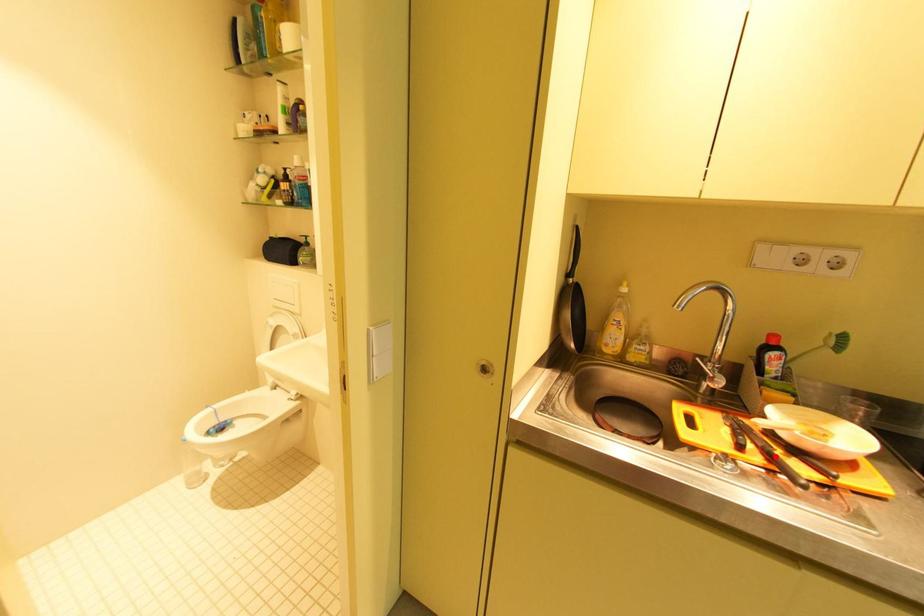
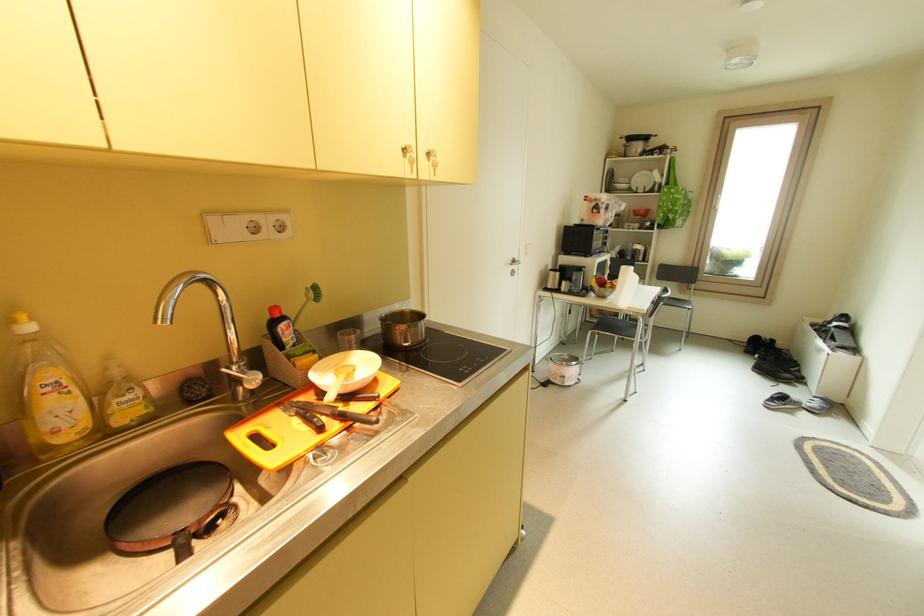
Question: I am providing you with two images of the same scene from different viewpoints. A red point is marked on the first image. At the location where the point appears in image 1, is it still visible in image 2?

Choices:
 (A) Yes
 (B) No

Answer: (A)